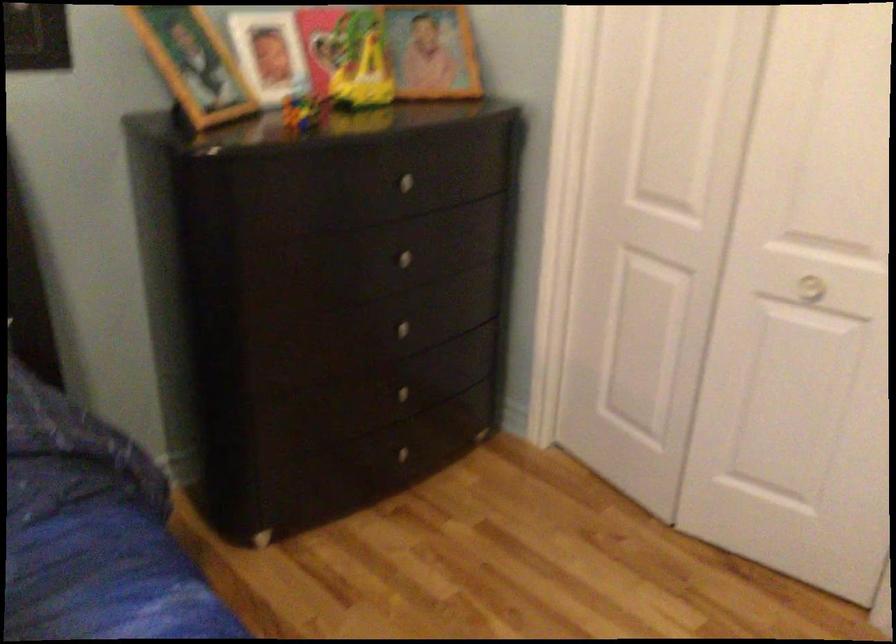
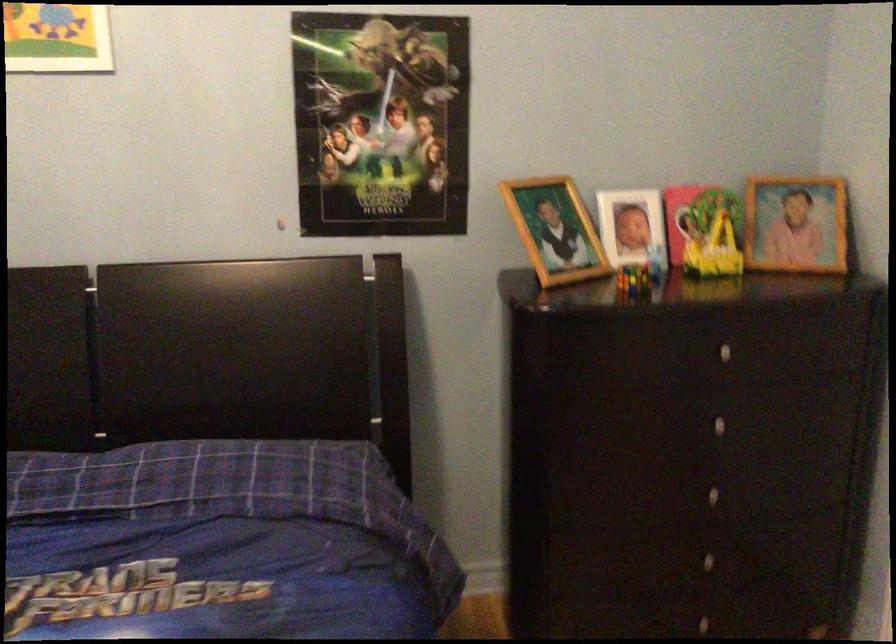
Find the pixel in the second image that matches (x=403, y=351) in the first image.

(711, 516)